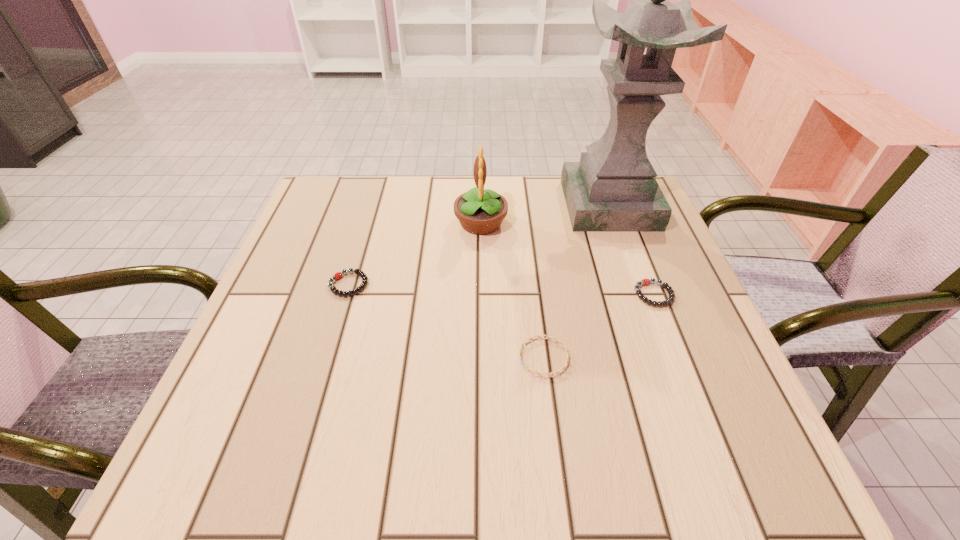
This screenshot has height=540, width=960. Find the location of `bracelet that is positioned at the right edge`. bracelet that is positioned at the right edge is located at coordinates (645, 281).

Where is `object at the far right corner`? object at the far right corner is located at coordinates (613, 188).

Where is `vacant space at the far edge`? The height and width of the screenshot is (540, 960). vacant space at the far edge is located at coordinates (427, 195).

I want to click on vacant space at the near edge of the desktop, so (x=578, y=457).

At what (x,y) coordinates should I click in order to perform the action: click on free space at the left edge of the desktop. Please return your answer as a coordinate pair (x, y). Looking at the image, I should click on (316, 233).

Where is `vacant area at the right edge`? This screenshot has height=540, width=960. vacant area at the right edge is located at coordinates click(x=681, y=309).

Image resolution: width=960 pixels, height=540 pixels. In the image, there is a desktop. Find the location of `vacant space at the far left corner`. vacant space at the far left corner is located at coordinates (336, 180).

Find the location of a particular element. Image resolution: width=960 pixels, height=540 pixels. free space at the near left corner of the desktop is located at coordinates (242, 440).

Identify the location of free spot between the rightmost bracelet and the tallest object. (632, 249).

Image resolution: width=960 pixels, height=540 pixels. In order to click on free space between the tallest object and the leftmost object in this screenshot , I will do `click(479, 245)`.